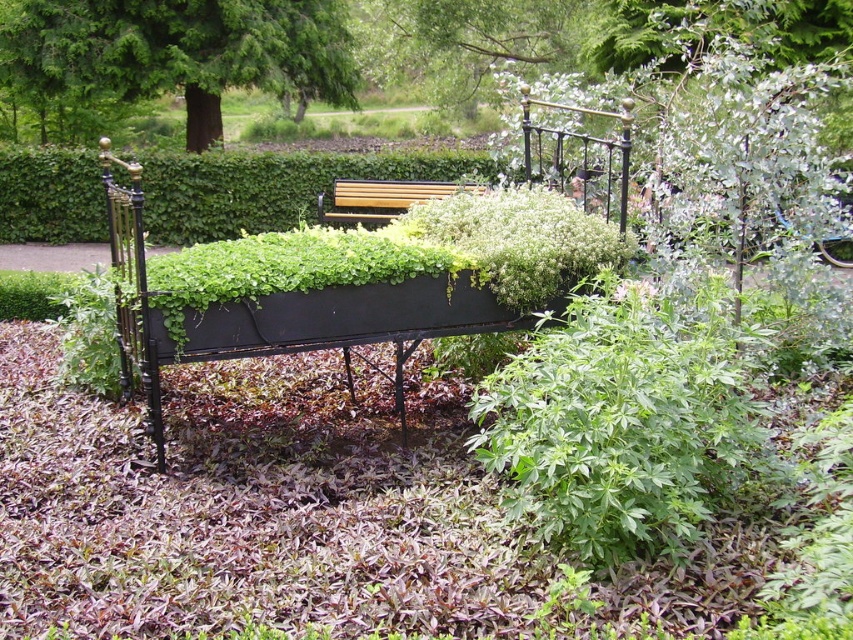
Is point (90, 214) positioned after point (392, 212)?

Yes, it is behind point (392, 212).

Is point (393, 166) positioned behind point (384, 202)?

Yes, it is behind point (384, 202).

What are the coordinates of `green leafy hedge at center` in the screenshot? It's located at (271, 186).

Does black metal bench at center have a larger size compared to green leafy hedge at center?

No.

Which is below, black metal bench at center or green leafy hedge at center?

Positioned lower is black metal bench at center.

This screenshot has height=640, width=853. I want to click on black metal bench at center, so click(x=384, y=292).

Image resolution: width=853 pixels, height=640 pixels. I want to click on black metal bench at center, so click(x=384, y=292).

Where is `green leafy bush at center`? This screenshot has width=853, height=640. green leafy bush at center is located at coordinates (624, 420).

Which is in front, point (592, 368) or point (463, 188)?

Point (592, 368) is more forward.

The width and height of the screenshot is (853, 640). Describe the element at coordinates (624, 420) in the screenshot. I see `green leafy bush at center` at that location.

I want to click on green leafy bush at center, so click(x=624, y=420).